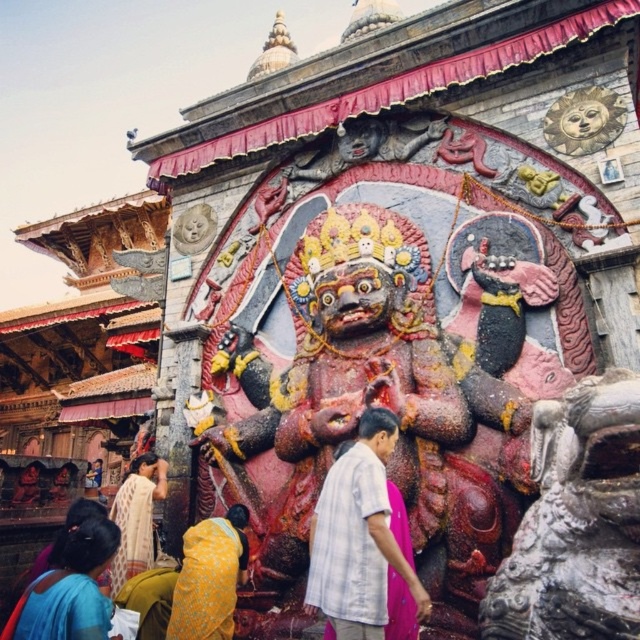
Question: Does white cotton shirt at center have a greater width compared to yellow fabric at lower left?

Choices:
 (A) no
 (B) yes

Answer: (B)

Question: Does white cotton shirt at center have a greater width compared to blue fabric sari at lower left?

Choices:
 (A) no
 (B) yes

Answer: (A)

Question: Which of these objects is positioned farthest from the polished stone statue at center?

Choices:
 (A) blue fabric sari at lower left
 (B) yellow fabric at lower left
 (C) light beige fabric at lower left
 (D) white cotton shirt at center

Answer: (C)

Question: Which object appears farthest from the camera in this image?

Choices:
 (A) white cotton shirt at center
 (B) light beige fabric at lower left

Answer: (B)

Question: Considering the real-world distances, which object is closest to the white cotton shirt at center?

Choices:
 (A) polished stone statue at center
 (B) yellow fabric at lower left
 (C) light beige fabric at lower left

Answer: (A)

Question: Considering the relative positions of white cotton shirt at center and yellow fabric at lower left in the image provided, where is white cotton shirt at center located with respect to yellow fabric at lower left?

Choices:
 (A) left
 (B) right

Answer: (B)